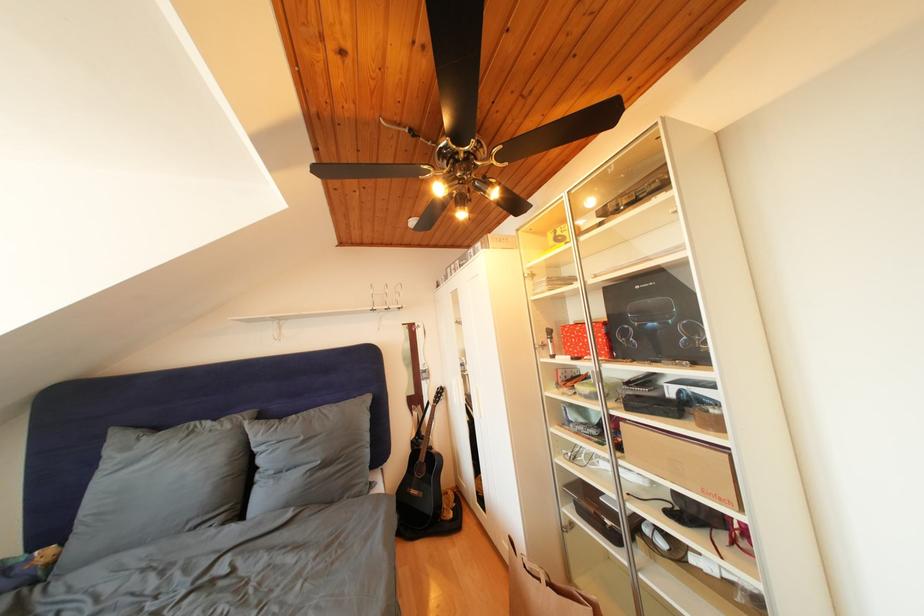
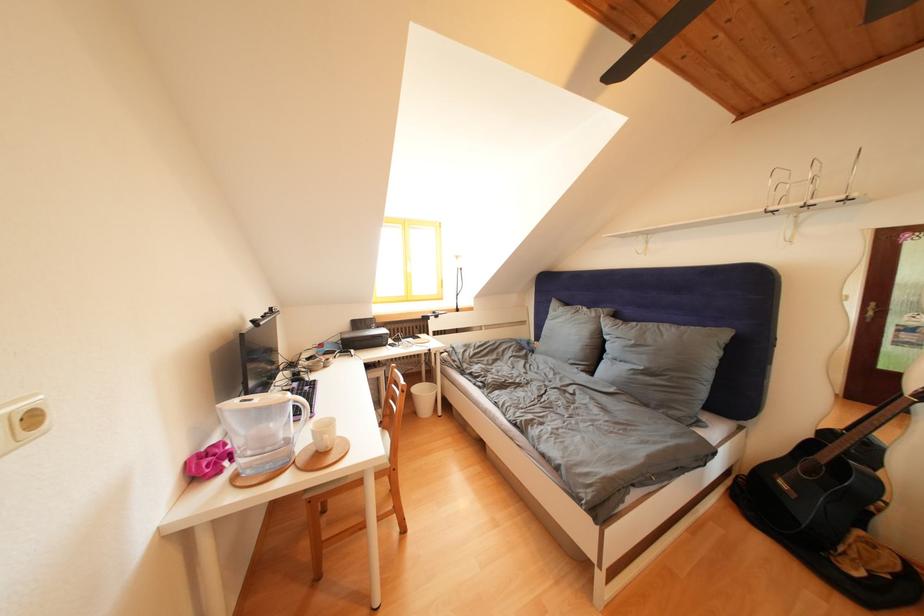
Locate, in the second image, the point that corresponds to (165,434) in the first image.

(575, 310)